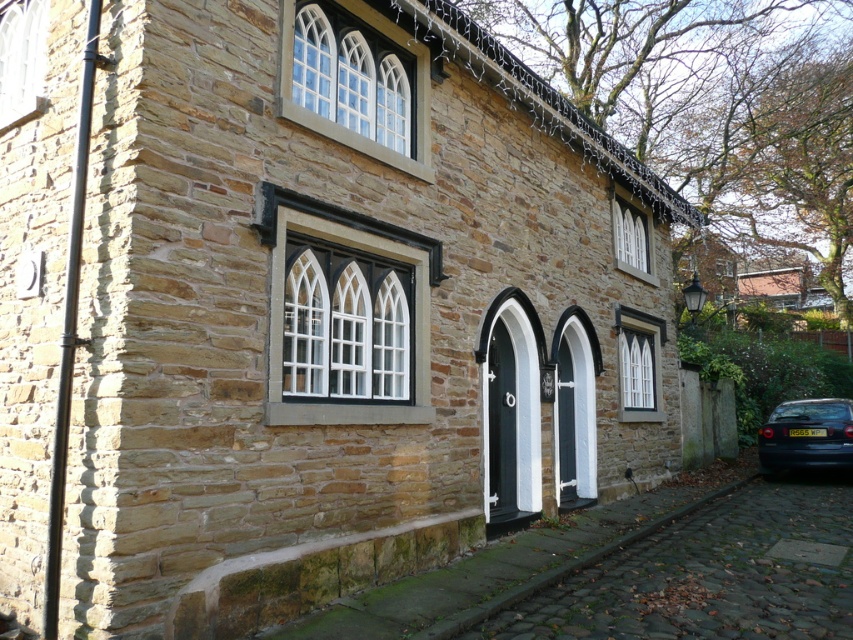
Question: Can you confirm if clear glass window at upper left is bigger than white glass window at upper right?

Choices:
 (A) yes
 (B) no

Answer: (B)

Question: Which point is farther from the camera taking this photo?

Choices:
 (A) (645, 403)
 (B) (633, 225)
 (C) (39, 49)

Answer: (B)

Question: Which point is closer to the camera taking this photo?

Choices:
 (A) (643, 237)
 (B) (651, 342)
 (C) (332, 234)

Answer: (C)

Question: Can you confirm if dark blue metallic car at lower right is bigger than white glass window at upper right?

Choices:
 (A) yes
 (B) no

Answer: (A)

Question: Which of the following is the farthest from the observer?

Choices:
 (A) black glass window at center
 (B) white glass window at upper right

Answer: (B)

Question: Observing the image, what is the correct spatial positioning of clear glass windows at upper center in reference to white glass window at upper right?

Choices:
 (A) above
 (B) below

Answer: (A)